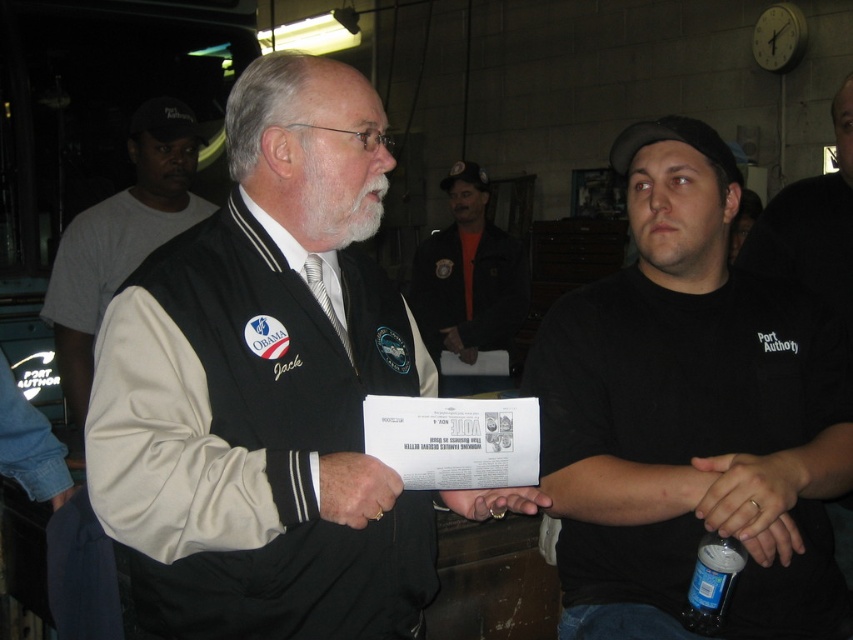
Between black cotton shirt at right and clear plastic bottle at lower right, which one appears on the left side from the viewer's perspective?

clear plastic bottle at lower right is more to the left.

The width and height of the screenshot is (853, 640). What do you see at coordinates (811, 221) in the screenshot? I see `black cotton shirt at right` at bounding box center [811, 221].

Between point (846, 276) and point (722, 609), which one is positioned behind?

The point (846, 276) is behind.

Where is `black cotton shirt at right`? black cotton shirt at right is located at coordinates (811, 221).

Which is more to the left, orange shirt at center or matte black hand at center?

From the viewer's perspective, orange shirt at center appears more on the left side.

Is point (415, 320) positioned before point (537, 496)?

No, it is behind (537, 496).

Measure the distance between orange shirt at center and camera.

They are 4.12 meters apart.

The image size is (853, 640). In order to click on orange shirt at center in this screenshot , I will do `click(467, 275)`.

Does black cotton shirt at center appear on the right side of matte black hand at center?

Yes, black cotton shirt at center is to the right of matte black hand at center.

Which is in front, point (672, 136) or point (549, 502)?

Point (549, 502) is in front.

The image size is (853, 640). Find the location of `black cotton shirt at center`. black cotton shirt at center is located at coordinates (691, 417).